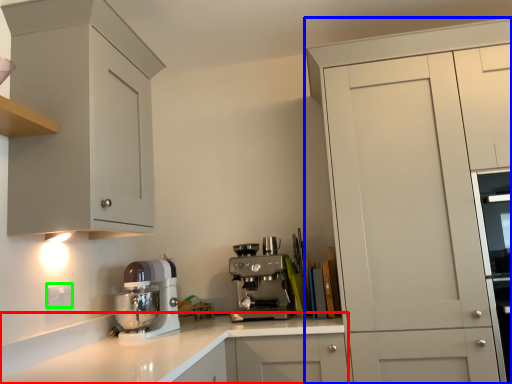
Question: Which is nearer to the countertop (highlighted by a red box)? cabinetry (highlighted by a blue box) or electric outlet (highlighted by a green box).

Choices:
 (A) cabinetry
 (B) electric outlet

Answer: (B)